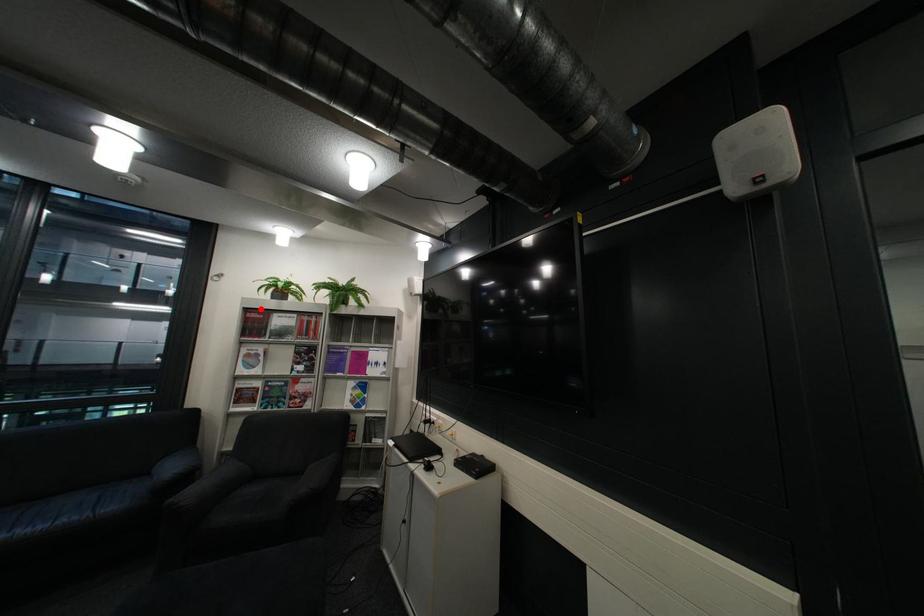
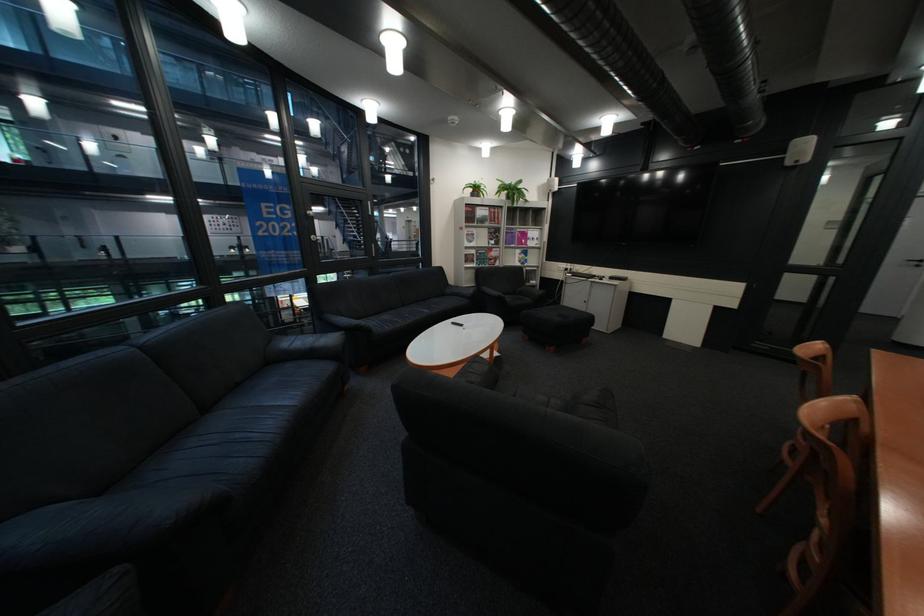
Find the pixel in the second image that matches the highlighted location in the first image.

(481, 205)